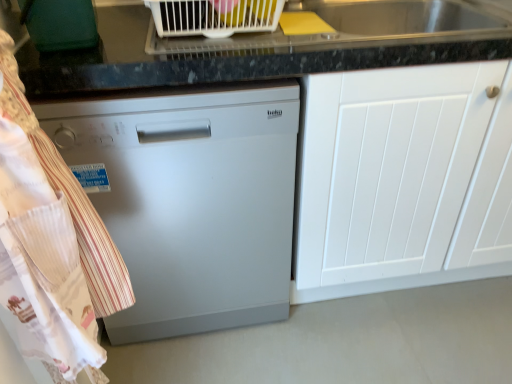
Locate an element on the screen. This screenshot has height=384, width=512. white striped fabric at left is located at coordinates (41, 244).

The height and width of the screenshot is (384, 512). Identify the location of white striped fabric at left. (41, 244).

Is white plastic dish rack at upper center touching white striped fabric at left?

white plastic dish rack at upper center and white striped fabric at left are not in contact.

Is white plastic dish rack at upper center smaller than white striped fabric at left?

Indeed, white plastic dish rack at upper center has a smaller size compared to white striped fabric at left.

From the image's perspective, between white plastic dish rack at upper center and white striped fabric at left, which one is located above?

white plastic dish rack at upper center.

Does white plastic dish rack at upper center have a greater height compared to white striped fabric at left?

No.

Do you think white matte cabinet at center is within white plastic dish rack at upper center, or outside of it?

white matte cabinet at center is not inside white plastic dish rack at upper center, it's outside.

From the image's perspective, is white matte cabinet at center over white plastic dish rack at upper center?

Actually, white matte cabinet at center appears below white plastic dish rack at upper center in the image.

Could you tell me if white matte cabinet at center is facing white plastic dish rack at upper center?

No, white matte cabinet at center is not oriented towards white plastic dish rack at upper center.

Is white matte cabinet at center not close to white plastic dish rack at upper center?

Actually, white matte cabinet at center and white plastic dish rack at upper center are a little close together.

Can you tell me how much white striped fabric at left and white plastic dish rack at upper center differ in facing direction?

They differ by 90 degrees in their facing directions.

Is white striped fabric at left facing away from white plastic dish rack at upper center?

No, white striped fabric at left's orientation is not away from white plastic dish rack at upper center.

Are white striped fabric at left and white plastic dish rack at upper center beside each other?

white striped fabric at left is not next to white plastic dish rack at upper center, and they're not touching.

Which object is thinner, white striped fabric at left or white plastic dish rack at upper center?

white striped fabric at left.

Is white striped fabric at left situated inside white matte cabinet at center or outside?

white striped fabric at left lies outside white matte cabinet at center.

From a real-world perspective, is white striped fabric at left below white matte cabinet at center?

No.

Does white striped fabric at left have a smaller size compared to white matte cabinet at center?

Indeed, white striped fabric at left has a smaller size compared to white matte cabinet at center.

Can you confirm if white striped fabric at left is wider than white matte cabinet at center?

In fact, white striped fabric at left might be narrower than white matte cabinet at center.

From the picture: Which of these two, white striped fabric at left or satin silver dishwasher at center, stands shorter?

With less height is satin silver dishwasher at center.

Between white striped fabric at left and satin silver dishwasher at center, which one has smaller width?

white striped fabric at left is thinner.

Is white striped fabric at left outside of satin silver dishwasher at center?

white striped fabric at left is positioned outside satin silver dishwasher at center.

Is point (23, 137) closer to camera compared to point (255, 221)?

Yes, it is in front of point (255, 221).

Is satin silver dishwasher at center in contact with white plastic dish rack at upper center?

No, satin silver dishwasher at center is not next to white plastic dish rack at upper center.

Would you say satin silver dishwasher at center is inside or outside white plastic dish rack at upper center?

The correct answer is: outside.

Does satin silver dishwasher at center have a greater width compared to white plastic dish rack at upper center?

Yes, satin silver dishwasher at center is wider than white plastic dish rack at upper center.

Find the location of a particular element. The width and height of the screenshot is (512, 384). laundry located above the white matte cabinet at center (from a real-world perspective) is located at coordinates (x=41, y=244).

Does white matte cabinet at center have a smaller size compared to white striped fabric at left?

Actually, white matte cabinet at center might be larger than white striped fabric at left.

Does point (314, 238) lie in front of point (15, 187)?

No.

Find the location of a particular element. appliance to the right of white striped fabric at left is located at coordinates (214, 16).

The width and height of the screenshot is (512, 384). What are the coordinates of `appliance on the left of white matte cabinet at center` in the screenshot? It's located at (214, 16).

Considering their positions, is white matte cabinet at center positioned further to white plastic dish rack at upper center than satin silver dishwasher at center?

white matte cabinet at center lies further to white plastic dish rack at upper center than the other object.

Considering their positions, is white matte cabinet at center positioned further to white plastic dish rack at upper center than white striped fabric at left?

Based on the image, white striped fabric at left appears to be further to white plastic dish rack at upper center.

Looking at the image, which one is located further to white matte cabinet at center, white striped fabric at left or satin silver dishwasher at center?

white striped fabric at left is further to white matte cabinet at center.

Which object lies further to the anchor point satin silver dishwasher at center, white matte cabinet at center or white plastic dish rack at upper center?

Among the two, white plastic dish rack at upper center is located further to satin silver dishwasher at center.

In the scene shown: Looking at the image, which one is located closer to white matte cabinet at center, white plastic dish rack at upper center or satin silver dishwasher at center?

The object closer to white matte cabinet at center is satin silver dishwasher at center.

Considering their positions, is white striped fabric at left positioned closer to satin silver dishwasher at center than white plastic dish rack at upper center?

white striped fabric at left lies closer to satin silver dishwasher at center than the other object.

Considering their positions, is white striped fabric at left positioned closer to white plastic dish rack at upper center than satin silver dishwasher at center?

satin silver dishwasher at center is positioned closer to the anchor white plastic dish rack at upper center.

Which object lies nearer to the anchor point satin silver dishwasher at center, white striped fabric at left or white matte cabinet at center?

white striped fabric at left.

At what (x,y) coordinates should I click in order to perform the action: click on home appliance located between white striped fabric at left and white matte cabinet at center in the left-right direction. Please return your answer as a coordinate pair (x, y). Looking at the image, I should click on (190, 200).

I want to click on appliance between white striped fabric at left and white matte cabinet at center from left to right, so click(x=214, y=16).

Locate an element on the screen. The image size is (512, 384). home appliance between white plastic dish rack at upper center and white striped fabric at left from top to bottom is located at coordinates (190, 200).

Identify the location of appliance located between satin silver dishwasher at center and white matte cabinet at center in the left-right direction. click(x=214, y=16).